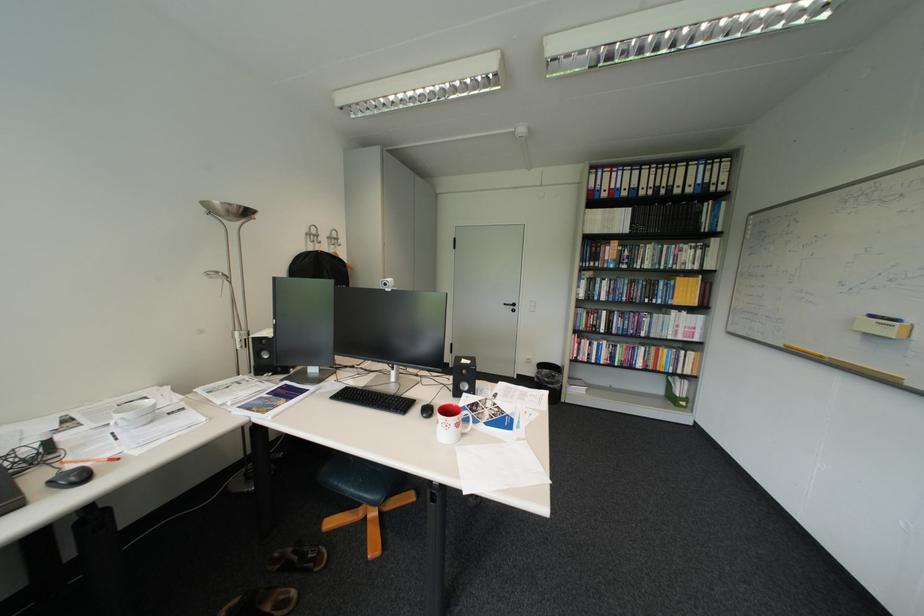
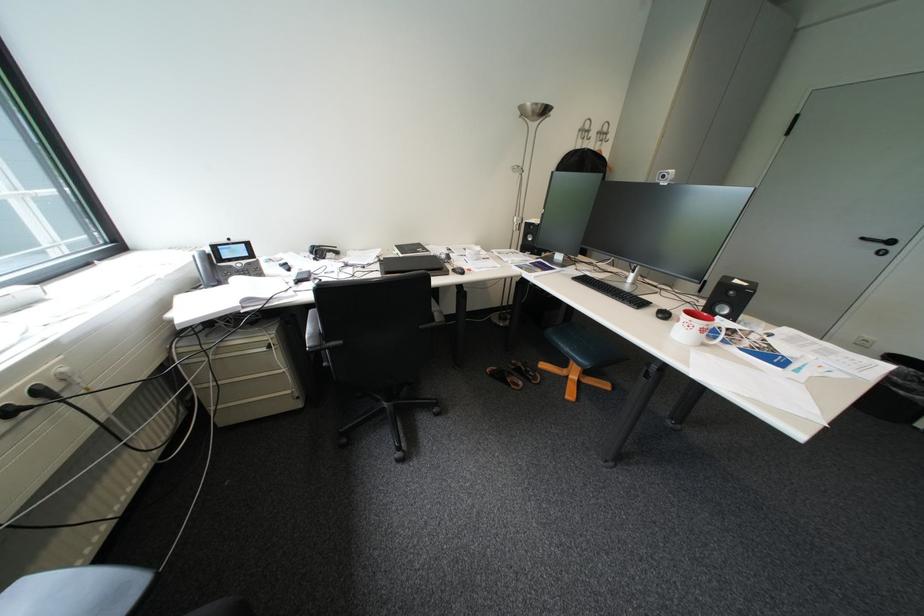
The point at (458,427) is marked in the first image. Where is the corresponding point in the second image?

(700, 326)